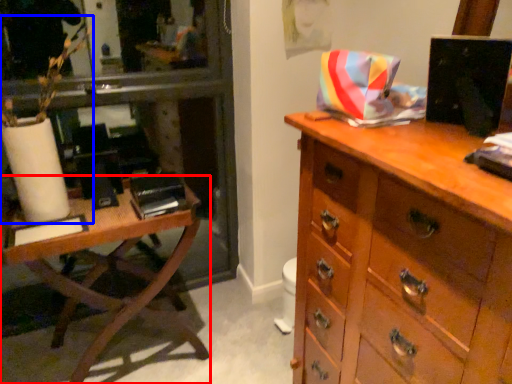
Question: Which object appears farthest to the camera in this image, table (highlighted by a red box) or plant (highlighted by a blue box)?

Choices:
 (A) table
 (B) plant

Answer: (A)